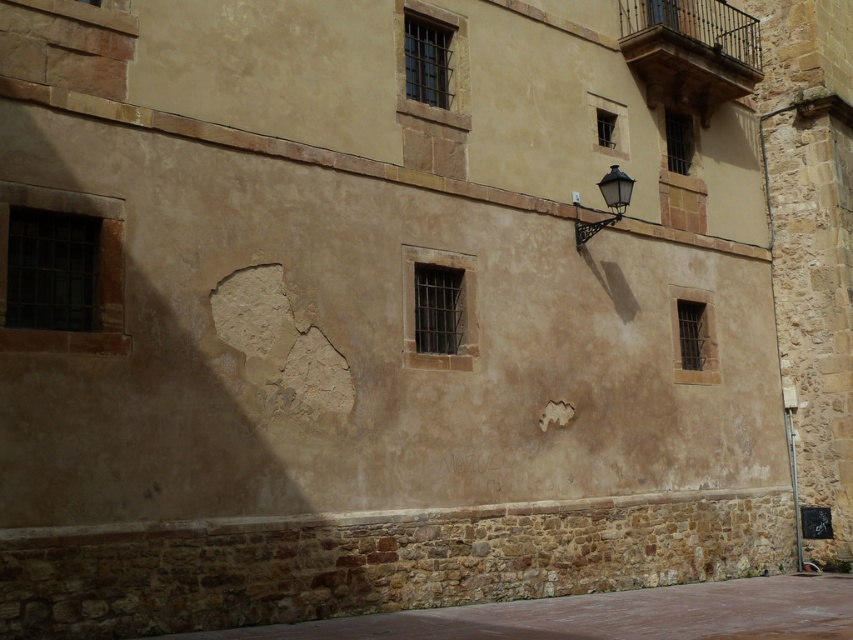
Question: Which point is closer to the camera taking this photo?

Choices:
 (A) (628, 180)
 (B) (669, 630)

Answer: (B)

Question: Does brown stone alley at lower center have a smaller size compared to black metal streetlamp at upper right?

Choices:
 (A) yes
 (B) no

Answer: (B)

Question: Which object is farther from the camera taking this photo?

Choices:
 (A) black metal streetlamp at upper right
 (B) brown stone alley at lower center

Answer: (A)

Question: Is brown stone alley at lower center wider than black metal streetlamp at upper right?

Choices:
 (A) no
 (B) yes

Answer: (B)

Question: Is brown stone alley at lower center further to camera compared to black metal streetlamp at upper right?

Choices:
 (A) no
 (B) yes

Answer: (A)